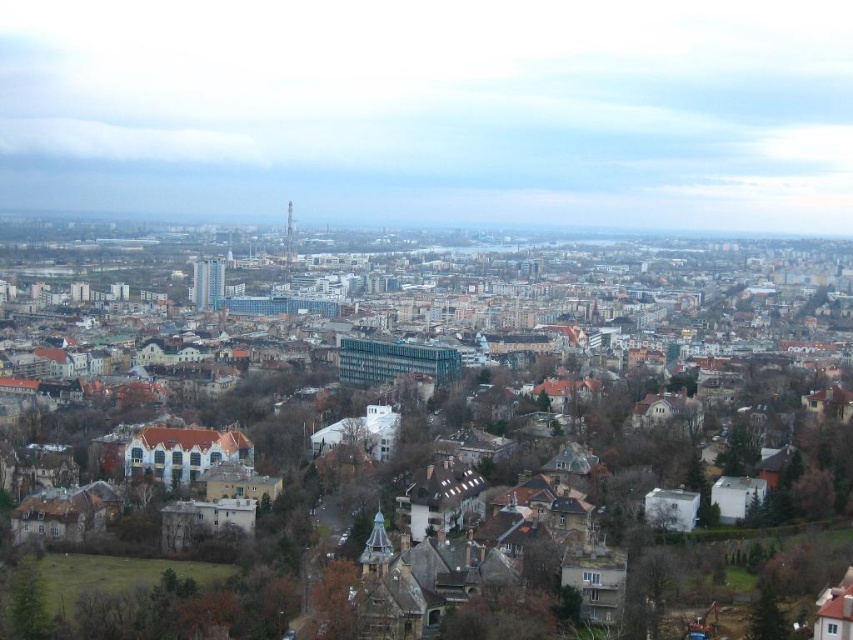
Question: Does brown stone buildings at center appear over brown textured tree at lower center?

Choices:
 (A) yes
 (B) no

Answer: (A)

Question: Which object appears closest to the camera in this image?

Choices:
 (A) brown stone buildings at center
 (B) brown textured tree at lower center

Answer: (A)

Question: Among these points, which one is farthest from the camera?

Choices:
 (A) (316, 461)
 (B) (347, 627)

Answer: (A)

Question: Considering the relative positions of brown stone buildings at center and brown textured tree at lower center in the image provided, where is brown stone buildings at center located with respect to brown textured tree at lower center?

Choices:
 (A) below
 (B) above

Answer: (B)

Question: Can you confirm if brown stone buildings at center is smaller than brown textured tree at lower center?

Choices:
 (A) yes
 (B) no

Answer: (B)